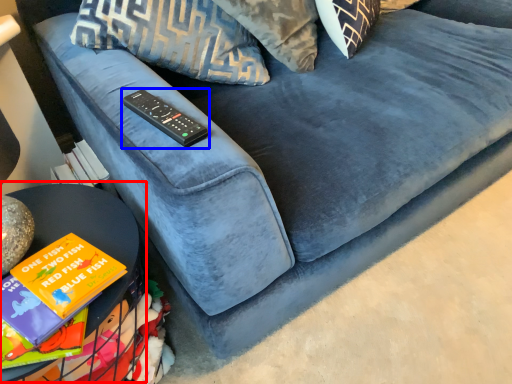
Question: Which object appears closest to the camera in this image, table (highlighted by a red box) or remote (highlighted by a blue box)?

Choices:
 (A) table
 (B) remote

Answer: (A)